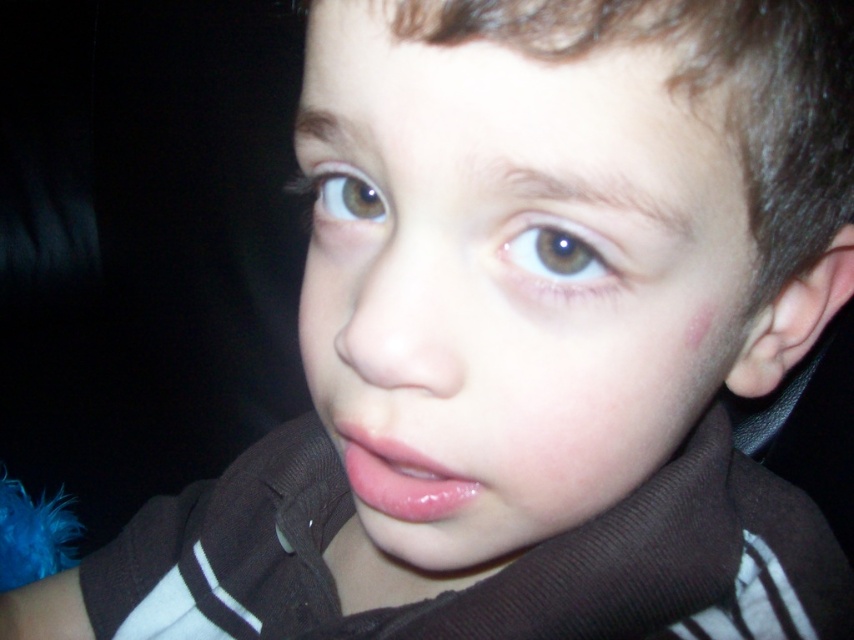
You are a photographer adjusting the focus on a camera. You have two points to focus on in the image of a child. The first point is at point (x=463, y=193) and the second point is at point (x=577, y=250). Which point should you focus on to capture the child more clearly?

Point (x=463, y=193) is closer to the viewer than point (x=577, y=250), so focusing on point (x=463, y=193) would capture the child more clearly.

Based on the scene description, where is the smooth skin face at center located in terms of coordinates?

The smooth skin face at center is located at coordinates point (510,284).